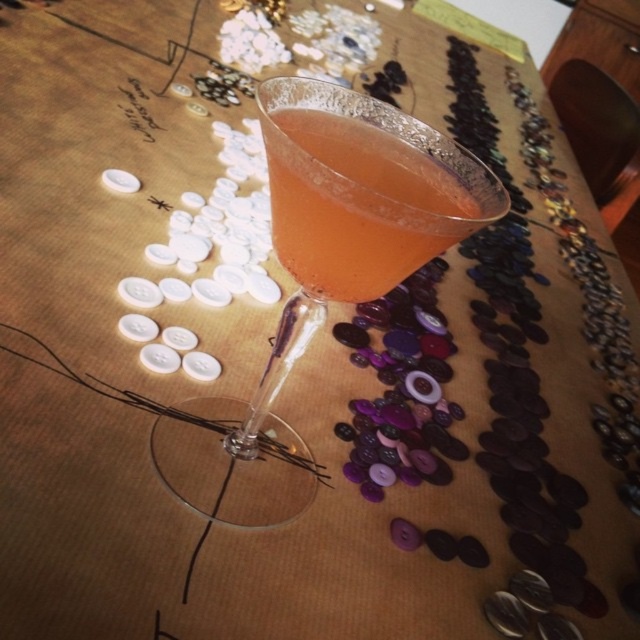
You are standing in front of the table with the cocktail glass and buttons. There are two points marked on the table surface. Which point is closer to you, point (212, 465) or point (372, 172)?

Point (212, 465) is further to the camera than point (372, 172), so the point closer to you is point (372, 172).

You are holding a small toy that is 3 inches wide. You want to place it on the table in the image so that it doesn not block the view of the cocktail glass. The cocktail glass is located at point (305, 212). Can you place your toy on the table without blocking the cocktail glass?

The distance between the viewer and point (305, 212) is 9.46 inches. Since the toy is only 3 inches wide, placing it on the table away from that point would ensure it doesn not block the cocktail glass.

You are a bartender preparing a drink and see the transparent glass cocktail at center and the translucent glass at center on the table. Which glass is closer to you?

The transparent glass cocktail at center is closer to you because it is in front of the translucent glass at center.